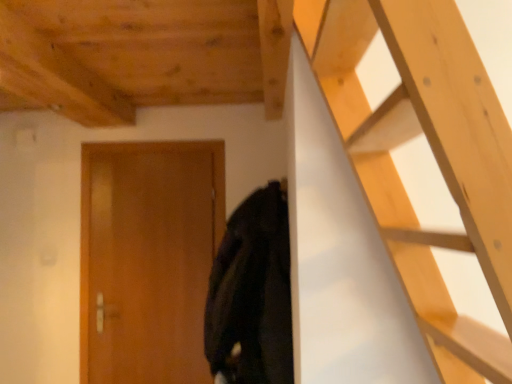
What do you see at coordinates (435, 157) in the screenshot?
I see `wooden at upper right` at bounding box center [435, 157].

Measure the distance between wooden door at center and camera.

wooden door at center and camera are 8.30 feet apart from each other.

Where is `black matte coat at center`? This screenshot has height=384, width=512. black matte coat at center is located at coordinates (252, 293).

Between wooden at upper right and wooden door at center, which one is positioned in front?

Positioned in front is wooden at upper right.

Between point (364, 46) and point (168, 309), which one is positioned in front?

The point (364, 46) is closer to the camera.

Is wooden at upper right spatially inside wooden door at center, or outside of it?

wooden at upper right is located beyond the bounds of wooden door at center.

Considering the relative positions of wooden at upper right and wooden door at center in the image provided, is wooden at upper right to the left or to the right of wooden door at center?

Clearly, wooden at upper right is on the right of wooden door at center in the image.

Who is taller, wooden door at center or black matte coat at center?

wooden door at center is taller.

From the image's perspective, between wooden door at center and black matte coat at center, who is located below?

wooden door at center appears lower in the image.

In the scene shown: Considering the positions of objects wooden door at center and black matte coat at center in the image provided, who is more to the left, wooden door at center or black matte coat at center?

wooden door at center is more to the left.

From the image's perspective, is black matte coat at center on top of wooden door at center?

Yes, from the image's perspective, black matte coat at center is above wooden door at center.

Is black matte coat at center positioned with its back to wooden door at center?

No, black matte coat at center is not facing the opposite direction of wooden door at center.

Which of these two, black matte coat at center or wooden door at center, stands taller?

wooden door at center.

Is black matte coat at center next to wooden at upper right and touching it?

black matte coat at center and wooden at upper right are clearly separated.

Between black matte coat at center and wooden at upper right, which one is positioned in front?

wooden at upper right is in front.

Based on the photo, considering the relative positions of black matte coat at center and wooden at upper right in the image provided, is black matte coat at center to the right of wooden at upper right from the viewer's perspective?

No, black matte coat at center is not to the right of wooden at upper right.

From the picture: From the image's perspective, does black matte coat at center appear lower than wooden at upper right?

Indeed, from the image's perspective, black matte coat at center is shown beneath wooden at upper right.

From the image's perspective, is wooden at upper right positioned above or below black matte coat at center?

Clearly, from the image's perspective, wooden at upper right is above black matte coat at center.

Does wooden at upper right have a larger size compared to black matte coat at center?

Correct, wooden at upper right is larger in size than black matte coat at center.

In terms of width, does wooden at upper right look wider or thinner when compared to black matte coat at center?

Clearly, wooden at upper right has more width compared to black matte coat at center.

Which is more to the right, wooden at upper right or black matte coat at center?

wooden at upper right.

Does wooden door at center lie behind wooden at upper right?

Yes, it is behind wooden at upper right.

Does wooden door at center appear on the left side of wooden at upper right?

Yes, wooden door at center is to the left of wooden at upper right.

Is wooden door at center oriented towards wooden at upper right?

No, wooden door at center does not turn towards wooden at upper right.

Locate an element on the screen. This screenshot has width=512, height=384. ladder above the wooden door at center (from a real-world perspective) is located at coordinates (435, 157).

Identify the location of door behind the black matte coat at center. (148, 258).

Based on their spatial positions, is wooden at upper right or black matte coat at center further from wooden door at center?

wooden at upper right is positioned further to the anchor wooden door at center.

From the picture: When comparing their distances from wooden door at center, does black matte coat at center or wooden at upper right seem further?

The object further to wooden door at center is wooden at upper right.

Considering their positions, is wooden at upper right positioned further to black matte coat at center than wooden door at center?

The object further to black matte coat at center is wooden at upper right.

Considering their positions, is wooden door at center positioned closer to black matte coat at center than wooden at upper right?

wooden door at center is positioned closer to the anchor black matte coat at center.

Looking at the image, which one is located closer to wooden at upper right, black matte coat at center or wooden door at center?

Among the two, black matte coat at center is located nearer to wooden at upper right.

Looking at the image, which one is located closer to wooden at upper right, wooden door at center or black matte coat at center?

The object closer to wooden at upper right is black matte coat at center.

Find the location of a particular element. This screenshot has height=384, width=512. cloak between wooden at upper right and wooden door at center along the z-axis is located at coordinates (252, 293).